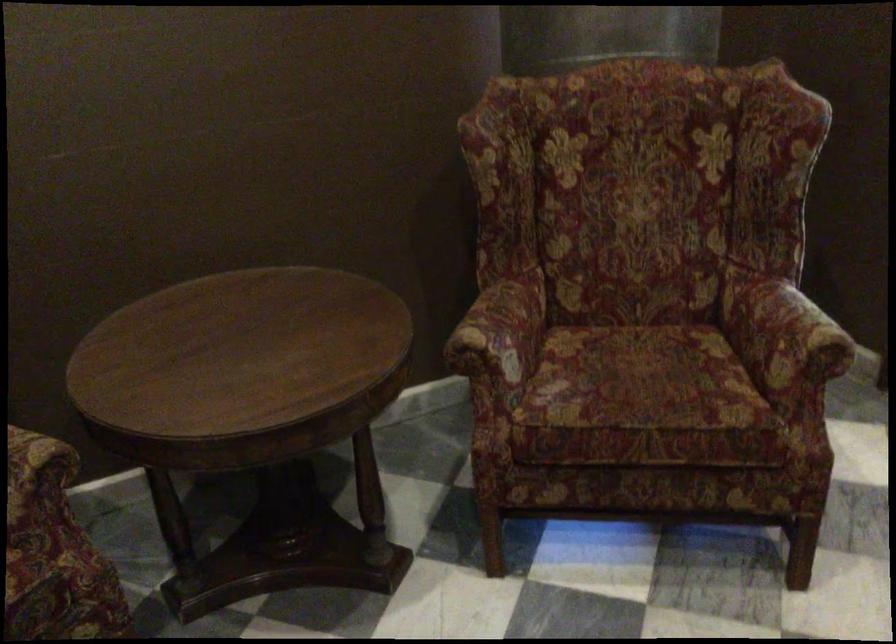
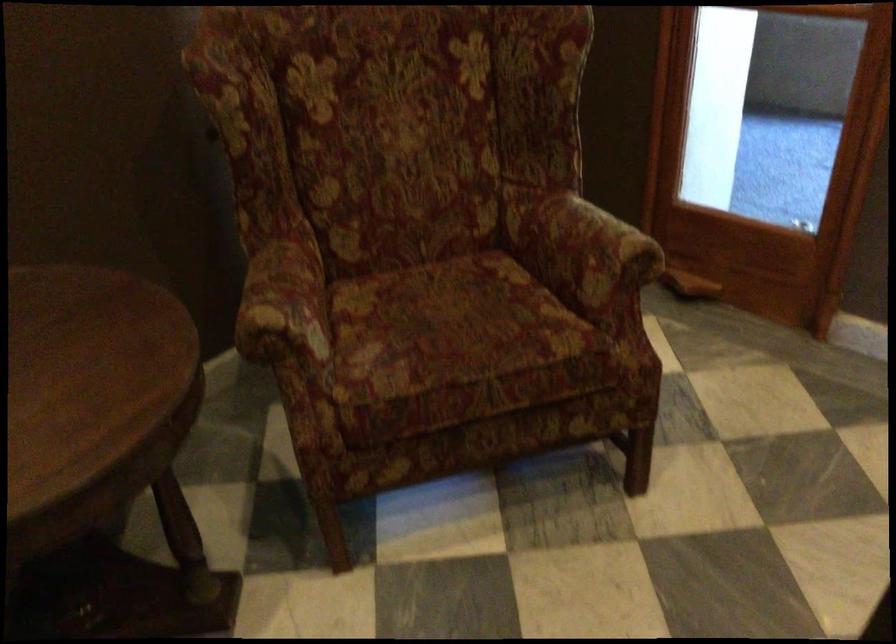
Question: The camera is either moving clockwise (left) or counter-clockwise (right) around the object. The first image is from the beginning of the video and the second image is from the end. Is the camera moving left or right when shooting the video?

Choices:
 (A) Left
 (B) Right

Answer: (A)